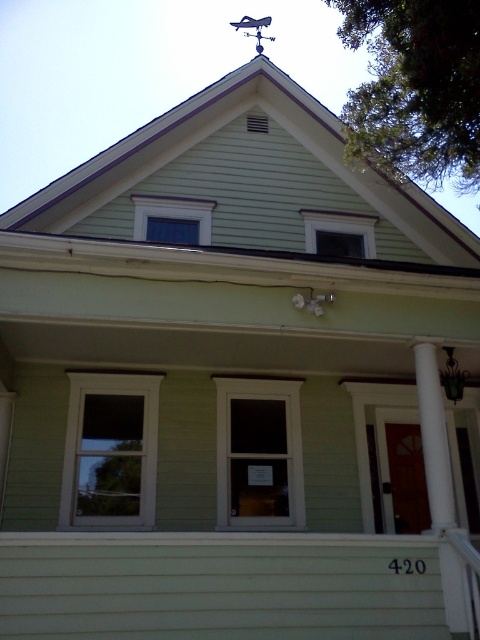
Question: Which point is farther to the camera?

Choices:
 (A) (71, 470)
 (B) (269, 513)

Answer: (B)

Question: Does blue glass window at upper center come in front of metallic weather vane at upper center?

Choices:
 (A) yes
 (B) no

Answer: (A)

Question: Considering the real-world distances, which object is farthest from the clear glass window at upper center?

Choices:
 (A) clear glass window at center
 (B) metallic weather vane at upper center
 (C) white wood window at center

Answer: (C)

Question: Is clear glass window at center in front of metallic weather vane at upper center?

Choices:
 (A) yes
 (B) no

Answer: (A)

Question: Which object is positioned closest to the clear glass window at upper center?

Choices:
 (A) white smooth column at right
 (B) white wood window at center
 (C) blue glass window at upper center

Answer: (C)

Question: Is green siding at center in front of blue glass window at upper center?

Choices:
 (A) no
 (B) yes

Answer: (B)